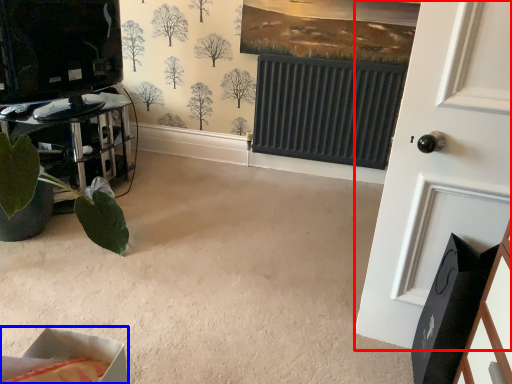
Question: Which object is closer to the camera taking this photo, door (highlighted by a red box) or cardboard box (highlighted by a blue box)?

Choices:
 (A) door
 (B) cardboard box

Answer: (B)